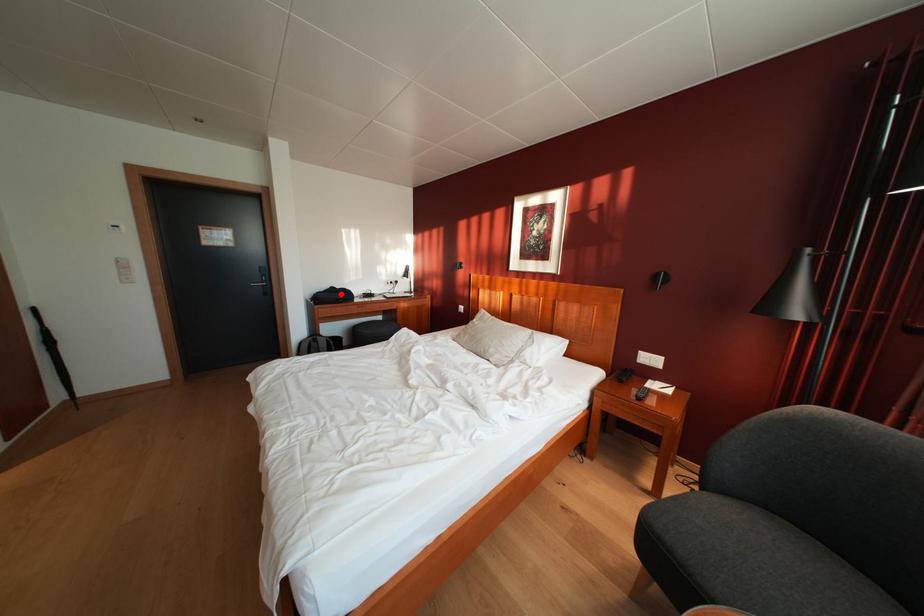
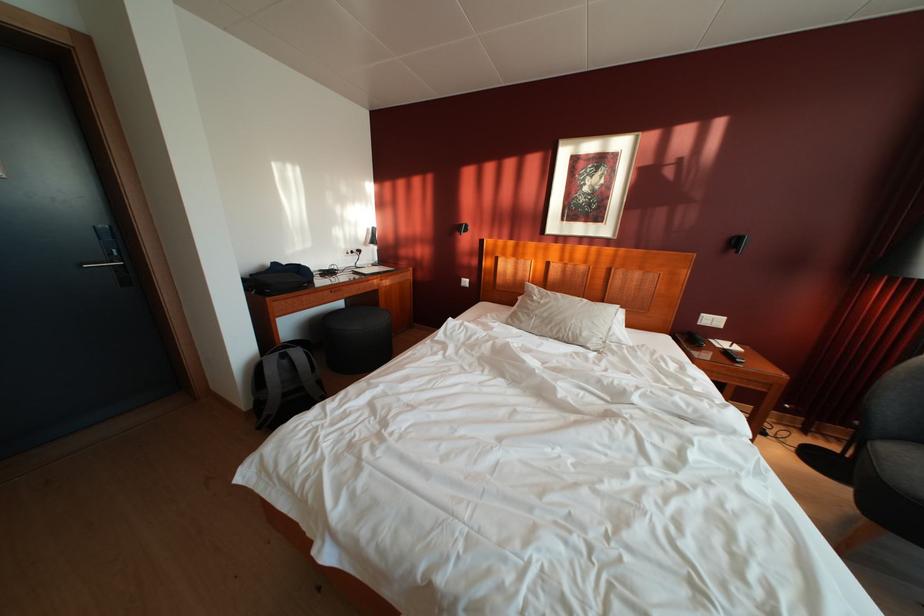
Question: A red point is marked in image1. In image2, is the corresponding 3D point closer to the camera or farther? Reply with the corresponding letter.

Choices:
 (A) The corresponding 3D point is closer.
 (B) The corresponding 3D point is farther.

Answer: (B)